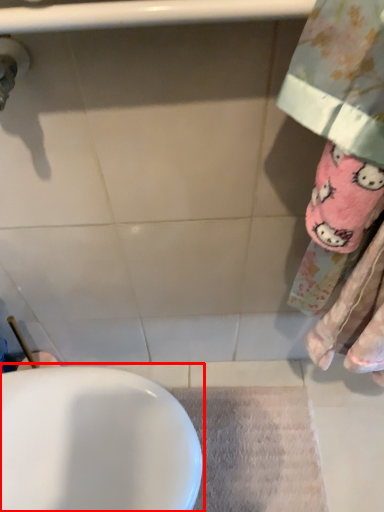
Question: Considering the relative positions of sink (annotated by the red box) and bath mat in the image provided, where is sink (annotated by the red box) located with respect to the staircase?

Choices:
 (A) right
 (B) left

Answer: (B)